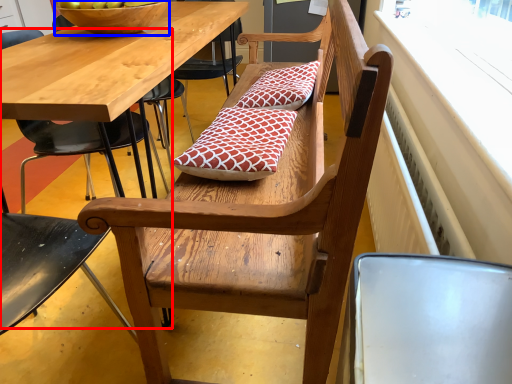
Question: Among these objects, which one is nearest to the camera, chair (highlighted by a red box) or bowl (highlighted by a blue box)?

Choices:
 (A) chair
 (B) bowl

Answer: (A)